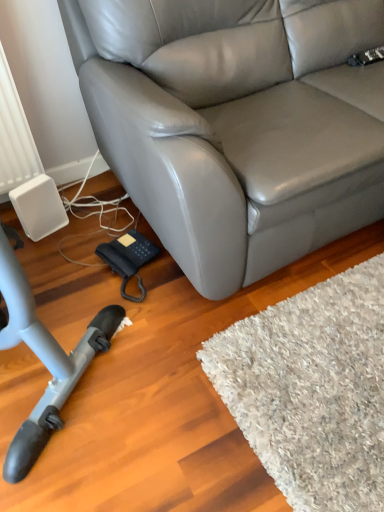
Describe the element at coordinates (236, 123) in the screenshot. I see `matte gray leather couch at center` at that location.

I want to click on matte gray leather couch at center, so click(x=236, y=123).

In order to face matte gray leather couch at center, should I rotate leftwards or rightwards?

Turn right by 18.827 degrees to look at matte gray leather couch at center.

Find the location of a particular element. This screenshot has height=512, width=384. matte gray leather couch at center is located at coordinates (236, 123).